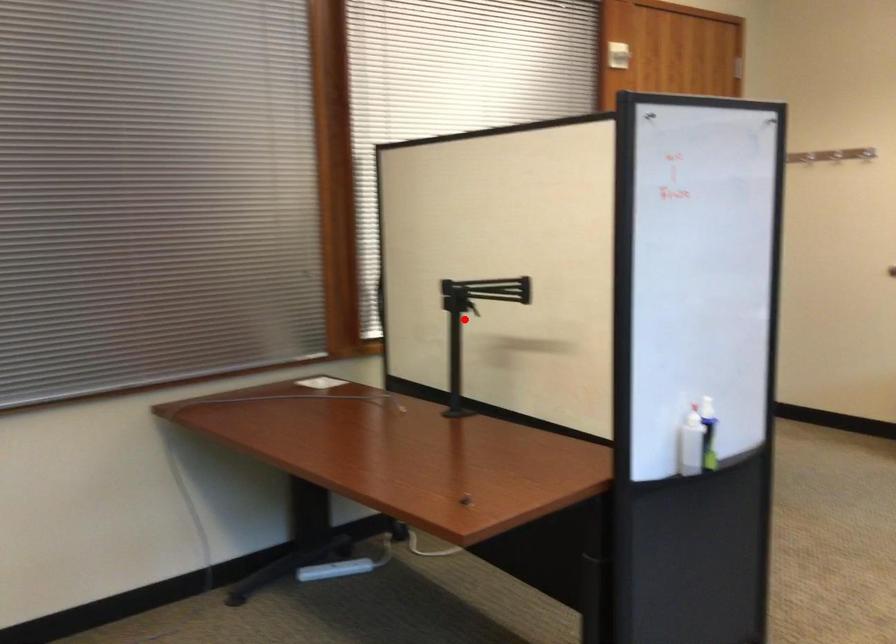
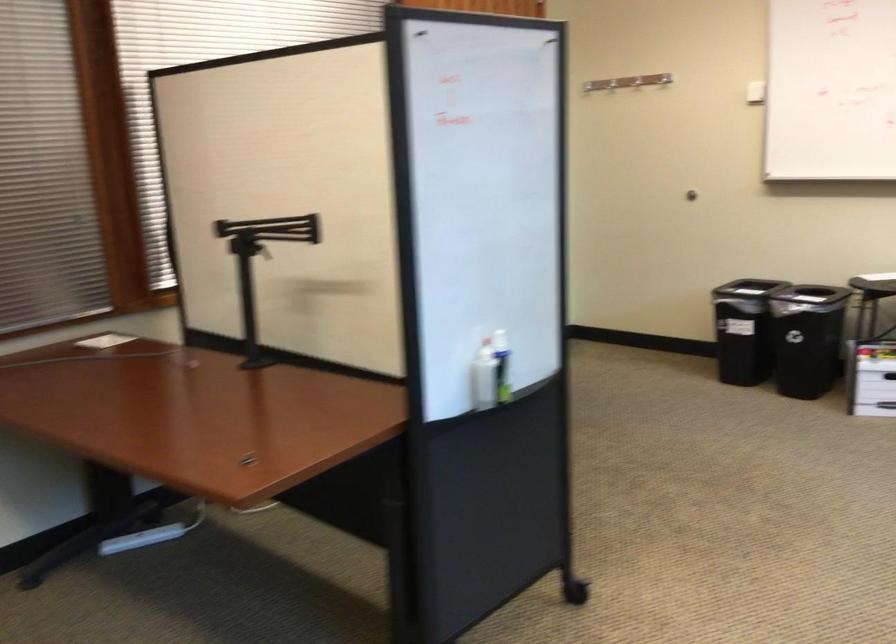
Find the pixel in the second image that matches the highlighted location in the first image.

(261, 263)